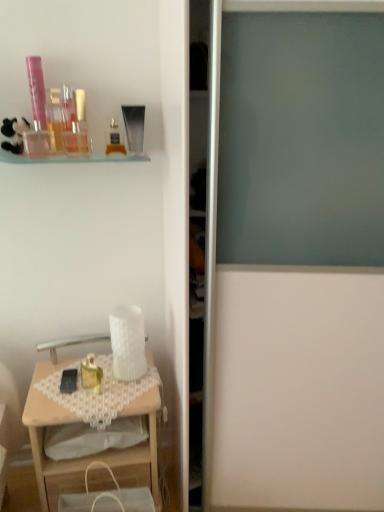
This screenshot has height=512, width=384. What are the coordinates of `free location in front of gold metallic perfume at lower left, which is the 8th toiletry in top-to-bottom order` in the screenshot? It's located at (87, 402).